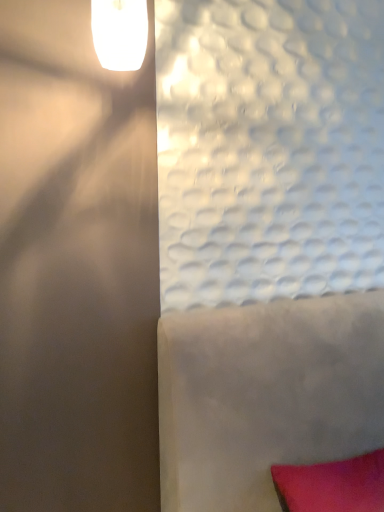
What is the approximate height of pink fabric pillow at lower right?

10.39 inches.

What is the approximate width of pink fabric pillow at lower right?

pink fabric pillow at lower right is 9.90 inches in width.

In order to click on pink fabric pillow at lower right in this screenshot , I will do `click(332, 485)`.

Describe the element at coordinates (332, 485) in the screenshot. The height and width of the screenshot is (512, 384). I see `pink fabric pillow at lower right` at that location.

Find the location of a particular element. The image size is (384, 512). pink fabric pillow at lower right is located at coordinates (332, 485).